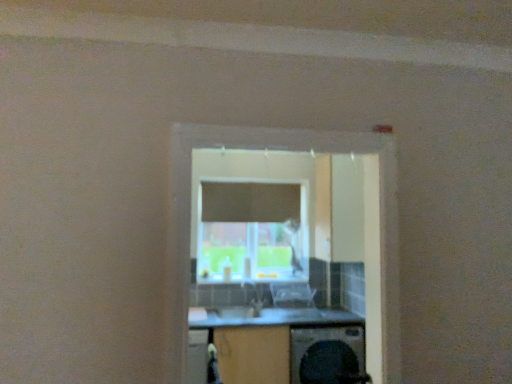
Locate an element on the screen. The image size is (512, 384). clear plastic chair at center is located at coordinates click(x=293, y=299).

What do you see at coordinates (293, 299) in the screenshot? The height and width of the screenshot is (384, 512). I see `clear plastic chair at center` at bounding box center [293, 299].

This screenshot has width=512, height=384. What do you see at coordinates (286, 150) in the screenshot? I see `transparent glass window at center` at bounding box center [286, 150].

Measure the distance between point [226,322] and camera.

They are 11.09 feet apart.

Find the location of a particular element. black plastic washing machine at lower center is located at coordinates (326, 354).

The image size is (512, 384). I want to click on clear plastic chair at center, so click(x=293, y=299).

From a real-world perspective, is clear plastic chair at center on top of black plastic washing machine at lower center?

Yes, from a real-world perspective, clear plastic chair at center is over black plastic washing machine at lower center

Can you confirm if clear plastic chair at center is taller than black plastic washing machine at lower center?

A: Incorrect, the height of clear plastic chair at center is not larger of that of black plastic washing machine at lower center.

Between clear plastic chair at center and black plastic washing machine at lower center, which one has larger size?

Bigger between the two is black plastic washing machine at lower center.

In the image, is clear plastic chair at center positioned in front of or behind black plastic washing machine at lower center?

Clearly, clear plastic chair at center is behind black plastic washing machine at lower center.

In terms of width, does black plastic washing machine at lower center look wider or thinner when compared to transparent glass window at center?

In the image, black plastic washing machine at lower center appears to be wider than transparent glass window at center.

The width and height of the screenshot is (512, 384). I want to click on home appliance on the right of transparent glass window at center, so click(326, 354).

Is transparent glass window at center surrounded by black plastic washing machine at lower center?

That's incorrect, transparent glass window at center is not inside black plastic washing machine at lower center.

From a real-world perspective, does transparent glass window at center stand above clear plastic chair at center?

Yes, from a real-world perspective, transparent glass window at center is over clear plastic chair at center

Is the depth of transparent glass window at center greater than that of clear plastic chair at center?

No.

Considering the relative sizes of transparent glass window at center and clear plastic chair at center in the image provided, is transparent glass window at center thinner than clear plastic chair at center?

Yes, transparent glass window at center is thinner than clear plastic chair at center.

Considering the points (382, 195) and (303, 285), which point is behind, point (382, 195) or point (303, 285)?

The point (303, 285) is behind.

Which object is closer to the camera taking this photo, clear plastic chair at center or wooden at center?

wooden at center is in front.

Would you consider clear plastic chair at center to be distant from wooden at center?

No, there isn't a large distance between clear plastic chair at center and wooden at center.

Between clear plastic chair at center and wooden at center, which one appears on the left side from the viewer's perspective?

Positioned to the left is wooden at center.

From a real-world perspective, is black plastic washing machine at lower center on top of clear plastic chair at center?

No, from a real-world perspective, black plastic washing machine at lower center is not on top of clear plastic chair at center.

Is black plastic washing machine at lower center turned away from clear plastic chair at center?

No.

Is black plastic washing machine at lower center outside of clear plastic chair at center?

Yes, black plastic washing machine at lower center is not within clear plastic chair at center.

Considering the sizes of black plastic washing machine at lower center and clear plastic chair at center in the image, is black plastic washing machine at lower center taller or shorter than clear plastic chair at center?

In the image, black plastic washing machine at lower center appears to be taller than clear plastic chair at center.

From the image's perspective, between black plastic washing machine at lower center and wooden at center, which one is located above?

From the image's view, wooden at center is above.

Locate an element on the screen. This screenshot has height=384, width=512. home appliance below the wooden at center (from a real-world perspective) is located at coordinates (326, 354).

Is wooden at center at the back of black plastic washing machine at lower center?

Yes.

Between black plastic washing machine at lower center and wooden at center, which one has larger size?

With larger size is wooden at center.

In the image, is clear plastic chair at center on the left side or the right side of transparent glass window at center?

Clearly, clear plastic chair at center is on the right of transparent glass window at center in the image.

Which of these two, clear plastic chair at center or transparent glass window at center, is thinner?

Thinner between the two is transparent glass window at center.

Does point (276, 282) come farther from viewer compared to point (310, 146)?

Yes, point (276, 282) is behind point (310, 146).

Considering the sizes of clear plastic chair at center and transparent glass window at center in the image, is clear plastic chair at center taller or shorter than transparent glass window at center?

Clearly, clear plastic chair at center is shorter compared to transparent glass window at center.

At what (x,y) coordinates should I click in order to perform the action: click on computer chair on the left side of black plastic washing machine at lower center. Please return your answer as a coordinate pair (x, y). This screenshot has width=512, height=384. Looking at the image, I should click on (293, 299).

Where is `window above the black plastic washing machine at lower center (from a real-world perspective)`? This screenshot has width=512, height=384. window above the black plastic washing machine at lower center (from a real-world perspective) is located at coordinates (286, 150).

Considering their positions, is wooden at center positioned further to clear plastic chair at center than black plastic washing machine at lower center?

Among the two, black plastic washing machine at lower center is located further to clear plastic chair at center.

Considering their positions, is wooden at center positioned closer to black plastic washing machine at lower center than clear plastic chair at center?

wooden at center.

Estimate the real-world distances between objects in this image. Which object is closer to transparent glass window at center, clear plastic chair at center or black plastic washing machine at lower center?

black plastic washing machine at lower center is closer to transparent glass window at center.

In the scene shown: Which object lies nearer to the anchor point wooden at center, clear plastic chair at center or transparent glass window at center?

clear plastic chair at center is positioned closer to the anchor wooden at center.

When comparing their distances from black plastic washing machine at lower center, does transparent glass window at center or wooden at center seem further?

transparent glass window at center lies further to black plastic washing machine at lower center than the other object.

When comparing their distances from clear plastic chair at center, does black plastic washing machine at lower center or wooden at center seem closer?

Among the two, wooden at center is located nearer to clear plastic chair at center.

Which object lies further to the anchor point wooden at center, black plastic washing machine at lower center or clear plastic chair at center?

clear plastic chair at center is positioned further to the anchor wooden at center.

Considering their positions, is transparent glass window at center positioned closer to wooden at center than clear plastic chair at center?

Among the two, clear plastic chair at center is located nearer to wooden at center.

Find the location of a particular element. The width and height of the screenshot is (512, 384). computer desk between transparent glass window at center and black plastic washing machine at lower center from front to back is located at coordinates (281, 346).

Identify the location of home appliance positioned between transparent glass window at center and clear plastic chair at center from near to far. The height and width of the screenshot is (384, 512). (326, 354).

Identify the location of computer desk between clear plastic chair at center and black plastic washing machine at lower center from top to bottom. The width and height of the screenshot is (512, 384). (281, 346).

The width and height of the screenshot is (512, 384). Find the location of `computer desk between transparent glass window at center and clear plastic chair at center along the z-axis`. computer desk between transparent glass window at center and clear plastic chair at center along the z-axis is located at coordinates (281, 346).